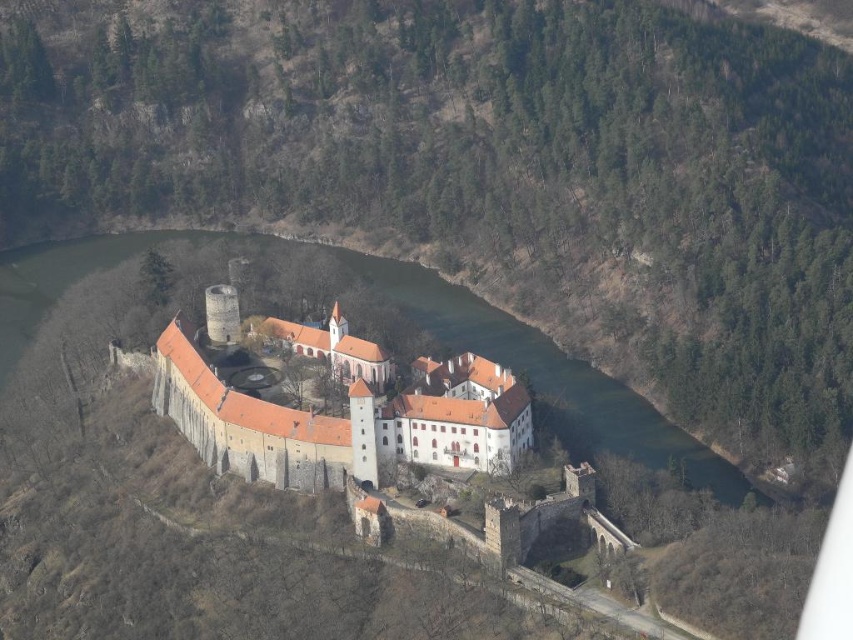
You are a drone operator flying a drone over the brown stone castle at center and the green water at center. Which object will the drone first encounter when moving straight forward from its current position?

The drone will first encounter the brown stone castle at center because it is closer to the viewer than the green water at center.

Based on the scene described, which object occupies a larger area in the image? Please consider the brown stone castle at center and the green water at center in your answer.

The green water at center occupies a larger area in the image compared to the brown stone castle at center, as stated in the objects description that the brown stone castle at center has a smaller size compared to green water at center.